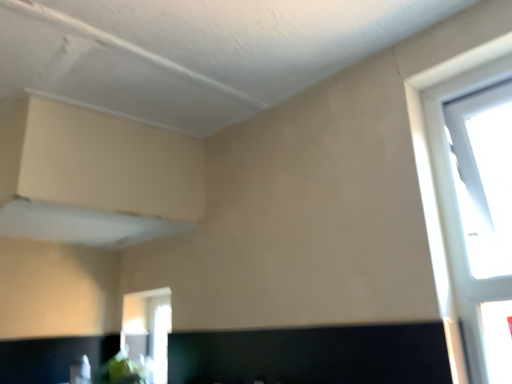
Where is `transparent glass window at lower left`? transparent glass window at lower left is located at coordinates (148, 328).

Measure the distance between point (141, 292) and camera.

Point (141, 292) is 2.12 meters from camera.

What do you see at coordinates (148, 328) in the screenshot?
I see `transparent glass window at lower left` at bounding box center [148, 328].

Where is `transparent glass window at lower left`? transparent glass window at lower left is located at coordinates (148, 328).